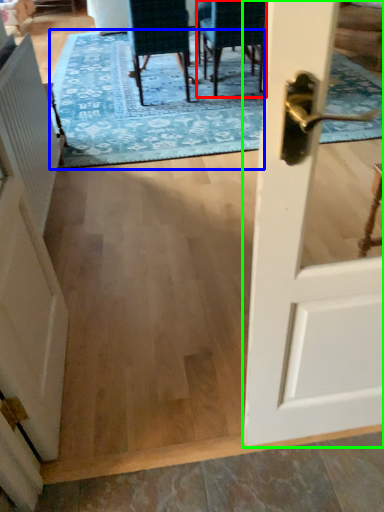
Question: Which is nearer to the chair (highlighted by a red box)? mat (highlighted by a blue box) or door (highlighted by a green box).

Choices:
 (A) mat
 (B) door

Answer: (A)